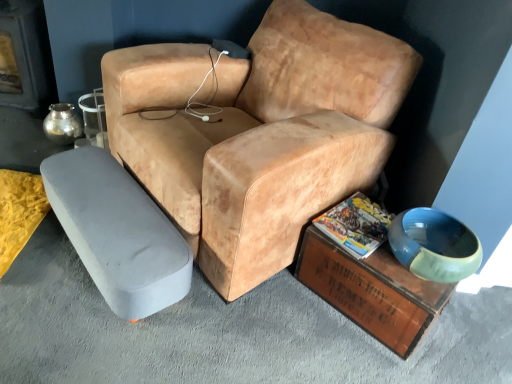
Where is `vacant space to the right of wooden crate at lower right, placed as the 2th table when sorted from left to right`? This screenshot has height=384, width=512. vacant space to the right of wooden crate at lower right, placed as the 2th table when sorted from left to right is located at coordinates (472, 330).